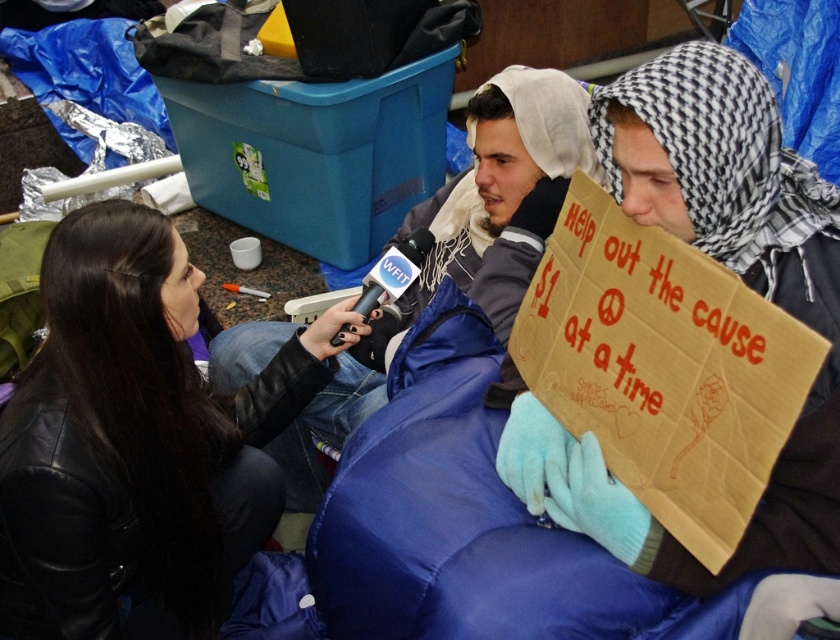
Is black leather jacket at lower left above blue puffy jacket at center?

Incorrect, black leather jacket at lower left is not positioned above blue puffy jacket at center.

Between black leather jacket at lower left and blue puffy jacket at center, which one appears on the right side from the viewer's perspective?

blue puffy jacket at center is more to the right.

This screenshot has width=840, height=640. I want to click on black leather jacket at lower left, so click(137, 442).

Where is `black leather jacket at lower left`? The width and height of the screenshot is (840, 640). black leather jacket at lower left is located at coordinates (137, 442).